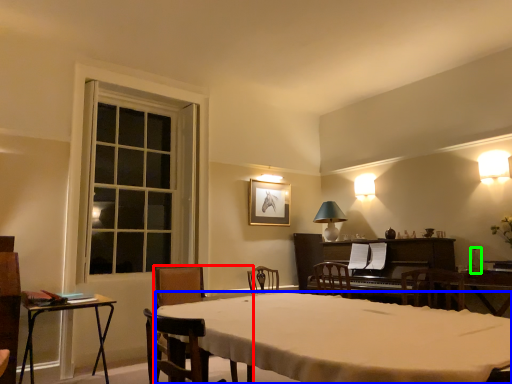
Question: Estimate the real-world distances between objects in this image. Which object is closer to chair (highlighted by a red box), desk (highlighted by a blue box) or bottle (highlighted by a green box)?

Choices:
 (A) desk
 (B) bottle

Answer: (A)